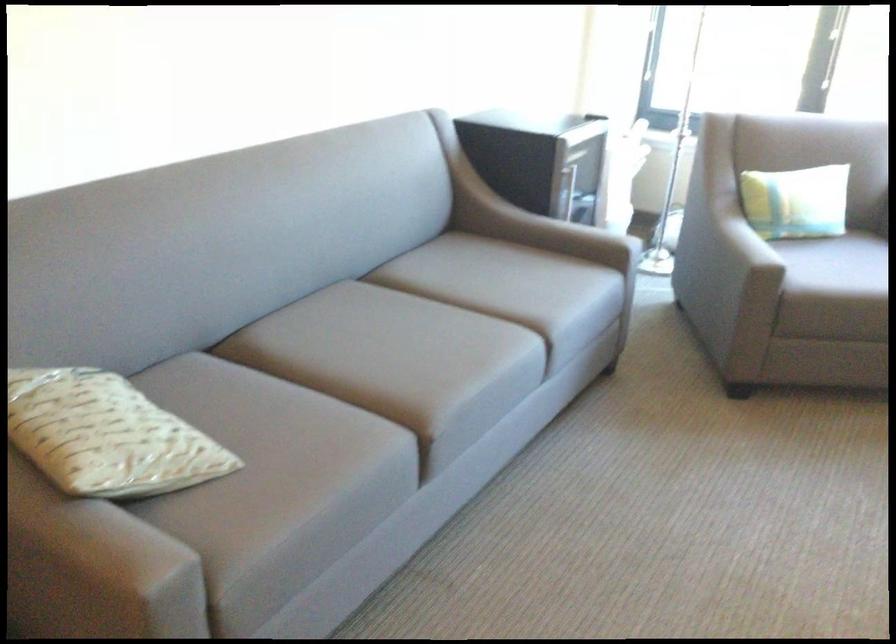
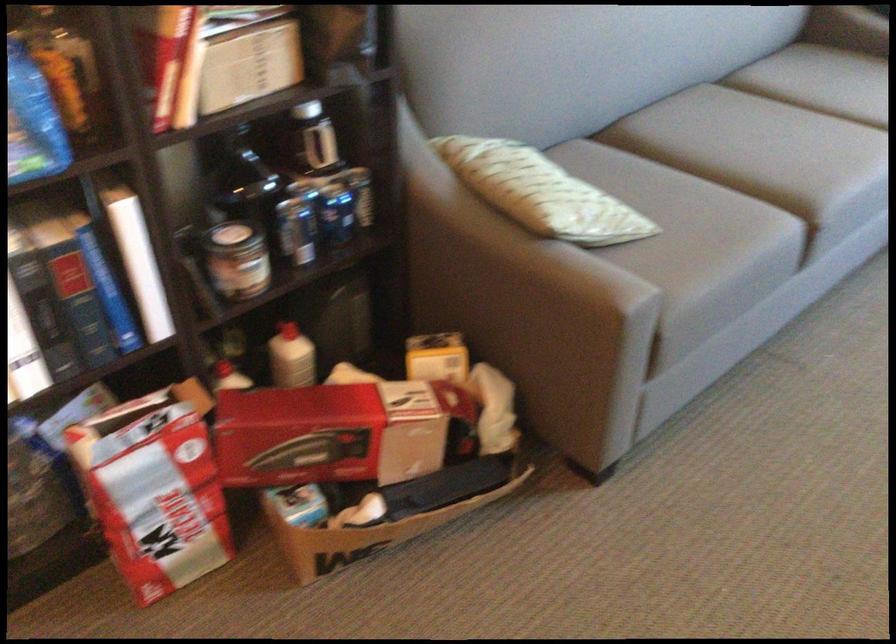
Find the pixel in the second image that matches point (76, 444) in the first image.

(537, 192)